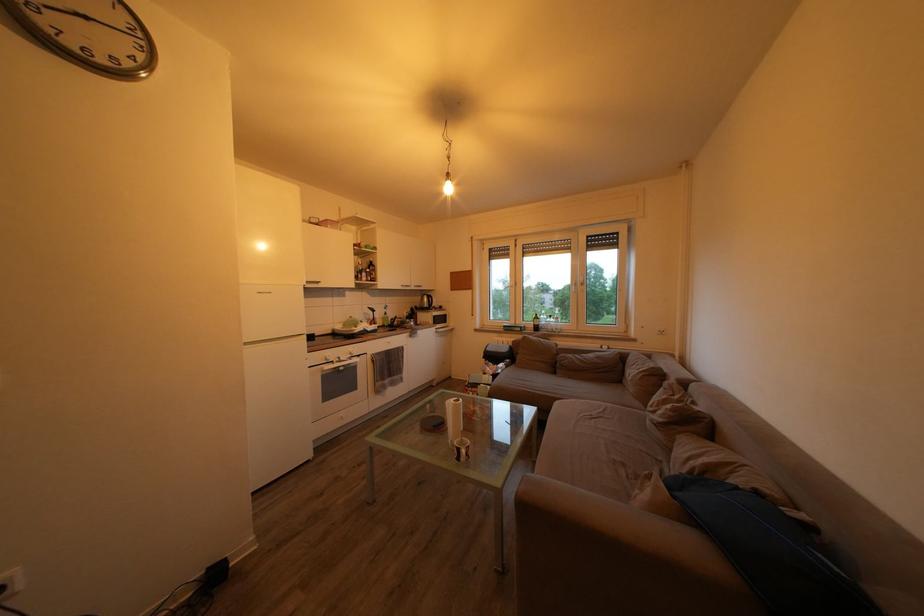
The image size is (924, 616). Find the location of `oven door handle`. oven door handle is located at coordinates (347, 368).